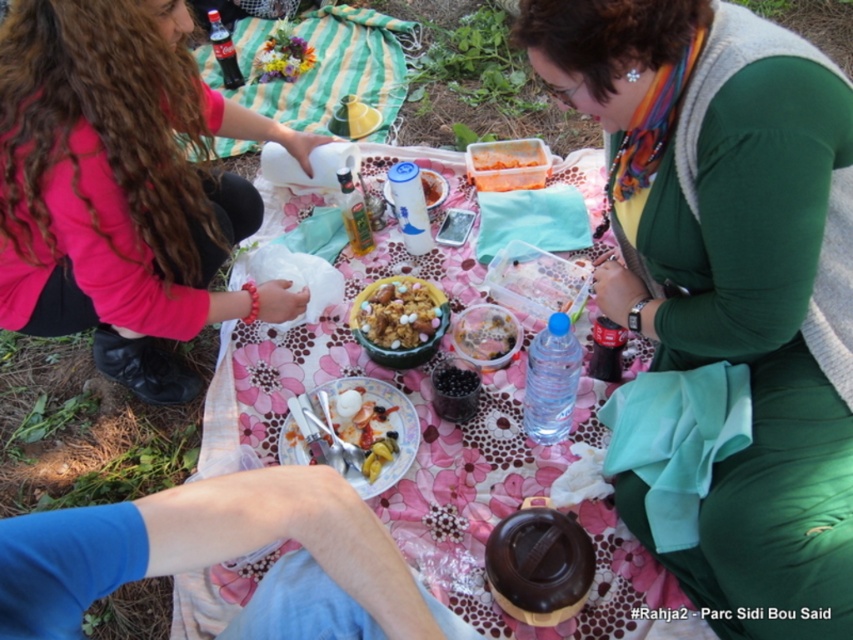
Measure the distance between green matte dress at center and camera.

The distance of green matte dress at center from camera is 1.03 meters.

Which of these two, green matte dress at center or pink floral cloth at center, stands taller?

With more height is pink floral cloth at center.

Between point (706, 60) and point (469, 588), which one is positioned behind?

The point (469, 588) is behind.

Locate an element on the screen. Image resolution: width=853 pixels, height=640 pixels. green matte dress at center is located at coordinates (723, 296).

Is pink floral cloth at center positioned at the back of shiny silver spoon at center?

No, it is not.

Can you confirm if pink floral cloth at center is thinner than shiny silver spoon at center?

No, pink floral cloth at center is not thinner than shiny silver spoon at center.

Between point (422, 496) and point (381, 474), which one is positioned in front?

Point (422, 496) is more forward.

You are a GUI agent. You are given a task and a screenshot of the screen. Output one action in this format:
    pyautogui.click(x=<x>, y=<y>)
    Task: Click on the pink floral cloth at center
    The image size is (853, 640).
    Given the screenshot: What is the action you would take?
    pyautogui.click(x=447, y=474)

Is point (315, 120) more distant than point (503, 189)?

Yes, point (315, 120) is farther from viewer.

Does point (200, 61) lie in front of point (543, 170)?

No, it is not.

Is point (323, 32) closer to viewer compared to point (509, 184)?

That is False.

Where is `green striped blanket at upper center`? green striped blanket at upper center is located at coordinates (318, 67).